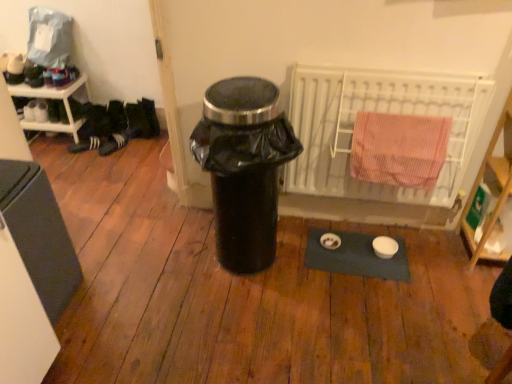
Locate an element on the screen. This screenshot has height=384, width=512. white metal radiator at upper right is located at coordinates (381, 112).

What is the approximate width of black matte shoe at left, which is counted as the 2th shoe, starting from the right?

4.23 inches.

Describe the element at coordinates (495, 184) in the screenshot. The height and width of the screenshot is (384, 512). I see `wooden shelf at right, which appears as the 2th shelf when viewed from the top` at that location.

This screenshot has width=512, height=384. In order to click on white metal radiator at upper right in this screenshot , I will do 381,112.

Considering the sizes of objects black plastic trash can at center and wooden shelf at right, which ranks as the 1th shelf in right-to-left order, in the image provided, who is bigger, black plastic trash can at center or wooden shelf at right, which ranks as the 1th shelf in right-to-left order,?

black plastic trash can at center.

Considering the positions of objects black plastic trash can at center and wooden shelf at right, which ranks as the 1th shelf in right-to-left order, in the image provided, who is more to the right, black plastic trash can at center or wooden shelf at right, which ranks as the 1th shelf in right-to-left order,?

wooden shelf at right, which ranks as the 1th shelf in right-to-left order.

Is black plastic trash can at center surrounding wooden shelf at right, which is counted as the 2th shelf, starting from the left?

No, wooden shelf at right, which is counted as the 2th shelf, starting from the left, is not a part of black plastic trash can at center.

Looking at this image, how different are the orientations of black plastic trash can at center and wooden shelf at right, which is counted as the 2th shelf, starting from the left, in degrees?

They differ by 2.05 degrees in their facing directions.

Which is behind, point (80, 145) or point (35, 125)?

Point (35, 125)

Considering the sizes of objects black matte shoe at left, which is counted as the 2th shoe, starting from the right, and white plastic shelf at left, the second shelf viewed from the right, in the image provided, who is smaller, black matte shoe at left, which is counted as the 2th shoe, starting from the right, or white plastic shelf at left, the second shelf viewed from the right,?

black matte shoe at left, which is counted as the 2th shoe, starting from the right, is smaller.

From the image's perspective, which one is positioned higher, black matte shoe at left, which is counted as the 2th shoe, starting from the right, or white plastic shelf at left, placed as the second shelf when sorted from bottom to top?

white plastic shelf at left, placed as the second shelf when sorted from bottom to top, appears higher in the image.

Is black matte shoe at left, which appears as the 1th shoe when viewed from the left, in front of or behind white plastic shelf at left, the second shelf viewed from the right, in the image?

black matte shoe at left, which appears as the 1th shoe when viewed from the left, is positioned farther from the viewer than white plastic shelf at left, the second shelf viewed from the right.

Based on the photo, how much distance is there between black plastic trash can at center and black matte shoe at left, which appears as the 1th shoe when viewed from the left?

black plastic trash can at center and black matte shoe at left, which appears as the 1th shoe when viewed from the left, are 4.99 feet apart.

Which is closer, (268, 146) or (69, 146)?

Point (268, 146)

From a real-world perspective, is black plastic trash can at center under black matte shoe at left, which is counted as the 2th shoe, starting from the right?

No, from a real-world perspective, black plastic trash can at center is not below black matte shoe at left, which is counted as the 2th shoe, starting from the right.

Which is behind, point (509, 183) or point (9, 92)?

The point (9, 92) is more distant.

Is wooden shelf at right, which is counted as the 2th shelf, starting from the left, next to white plastic shelf at left, the second shelf viewed from the right, and touching it?

No, wooden shelf at right, which is counted as the 2th shelf, starting from the left, is not beside white plastic shelf at left, the second shelf viewed from the right.

From a real-world perspective, is wooden shelf at right, which appears as the 2th shelf when viewed from the top, located beneath white plastic shelf at left, the first shelf when ordered from back to front?

No.

Between black plastic trash can at center and white metal radiator at upper right, which one appears on the left side from the viewer's perspective?

Positioned to the left is black plastic trash can at center.

Looking at their sizes, would you say black plastic trash can at center is wider or thinner than white metal radiator at upper right?

black plastic trash can at center is wider than white metal radiator at upper right.

Is black plastic trash can at center in front of or behind white metal radiator at upper right in the image?

In the image, black plastic trash can at center appears in front of white metal radiator at upper right.

Looking at this image, from a real-world perspective, is black plastic trash can at center positioned above or below white metal radiator at upper right?

black plastic trash can at center is below white metal radiator at upper right.

Is white textured shoe at left, which is the first shoe from right to left, surrounded by matte gray refrigerator at left?

No, white textured shoe at left, which is the first shoe from right to left, is not inside matte gray refrigerator at left.

From the image's perspective, which one is positioned higher, matte gray refrigerator at left or white textured shoe at left, which is the first shoe from right to left?

white textured shoe at left, which is the first shoe from right to left, is shown above in the image.

Is point (42, 172) less distant than point (108, 150)?

Yes, point (42, 172) is closer to viewer.

Can you confirm if matte gray refrigerator at left is thinner than white textured shoe at left, which appears as the 2th shoe when viewed from the left?

Incorrect, the width of matte gray refrigerator at left is not less than that of white textured shoe at left, which appears as the 2th shoe when viewed from the left.

Considering the sizes of white metal radiator at upper right and matte gray refrigerator at left in the image, is white metal radiator at upper right wider or thinner than matte gray refrigerator at left?

Considering their sizes, white metal radiator at upper right looks slimmer than matte gray refrigerator at left.

Is white metal radiator at upper right touching matte gray refrigerator at left?

No, white metal radiator at upper right is not touching matte gray refrigerator at left.

Looking at this image, is white metal radiator at upper right facing away from matte gray refrigerator at left?

No, white metal radiator at upper right's orientation is not away from matte gray refrigerator at left.

The width and height of the screenshot is (512, 384). Find the location of `the 1st shelf above when counting from the black plastic trash can at center (from the image's perspective)`. the 1st shelf above when counting from the black plastic trash can at center (from the image's perspective) is located at coordinates (495, 184).

The image size is (512, 384). What are the coordinates of `the 1st shoe counting from the right of the white plastic shelf at left, which is the first shelf in top-to-bottom order` in the screenshot? It's located at (85, 145).

From the image, which object appears to be nearer to white textured shoe at left, which appears as the 2th shoe when viewed from the left, black plastic trash can at center or wooden shelf at right, the first shelf when ordered from bottom to top?

The object closer to white textured shoe at left, which appears as the 2th shoe when viewed from the left, is black plastic trash can at center.

From the image, which object appears to be farther from white plastic shelf at left, the first shelf when ordered from back to front, wooden shelf at right, the 2th shelf viewed from the back, or white metal radiator at upper right?

Based on the image, wooden shelf at right, the 2th shelf viewed from the back, appears to be further to white plastic shelf at left, the first shelf when ordered from back to front.

Estimate the real-world distances between objects in this image. Which object is closer to white textured shoe at left, which appears as the 2th shoe when viewed from the left, black matte shoe at left, which appears as the 1th shoe when viewed from the left, or wooden shelf at right, the first shelf when ordered from bottom to top?

black matte shoe at left, which appears as the 1th shoe when viewed from the left, is positioned closer to the anchor white textured shoe at left, which appears as the 2th shoe when viewed from the left.

Looking at the image, which one is located further to white textured shoe at left, which is the first shoe from right to left, wooden shelf at right, which ranks as the 1th shelf in right-to-left order, or white plastic shelf at left, placed as the second shelf when sorted from bottom to top?

wooden shelf at right, which ranks as the 1th shelf in right-to-left order, lies further to white textured shoe at left, which is the first shoe from right to left, than the other object.

Based on their spatial positions, is wooden shelf at right, which appears as the 2th shelf when viewed from the top, or white metal radiator at upper right further from black plastic trash can at center?

wooden shelf at right, which appears as the 2th shelf when viewed from the top, lies further to black plastic trash can at center than the other object.

From the image, which object appears to be nearer to wooden shelf at right, the first shelf when ordered from bottom to top, white metal radiator at upper right or white textured shoe at left, which appears as the 2th shoe when viewed from the left?

Based on the image, white metal radiator at upper right appears to be nearer to wooden shelf at right, the first shelf when ordered from bottom to top.

Which object lies further to the anchor point white metal radiator at upper right, black plastic trash can at center or wooden shelf at right, which is counted as the 2th shelf, starting from the left?

Among the two, black plastic trash can at center is located further to white metal radiator at upper right.

Considering their positions, is white textured shoe at left, which is the first shoe from right to left, positioned further to matte gray refrigerator at left than wooden shelf at right, which appears as the first shelf when viewed from the front?

wooden shelf at right, which appears as the first shelf when viewed from the front, is positioned further to the anchor matte gray refrigerator at left.

The height and width of the screenshot is (384, 512). In order to click on shoe situated between black matte shoe at left, which is counted as the 2th shoe, starting from the right, and white metal radiator at upper right from left to right in this screenshot , I will do `click(117, 141)`.

Locate an element on the screen. furniture between black matte shoe at left, which appears as the 1th shoe when viewed from the left, and wooden shelf at right, which appears as the first shelf when viewed from the front, in the horizontal direction is located at coordinates (39, 234).

Locate an element on the screen. The image size is (512, 384). furniture situated between white textured shoe at left, which is the first shoe from right to left, and wooden shelf at right, the first shelf when ordered from bottom to top, from left to right is located at coordinates (39, 234).

You are a GUI agent. You are given a task and a screenshot of the screen. Output one action in this format:
    pyautogui.click(x=<x>, y=<y>)
    Task: Click on the waste container between matte gray refrigerator at left and wooden shelf at right, which appears as the first shelf when viewed from the front, in the horizontal direction
    The height and width of the screenshot is (384, 512).
    Given the screenshot: What is the action you would take?
    244,167